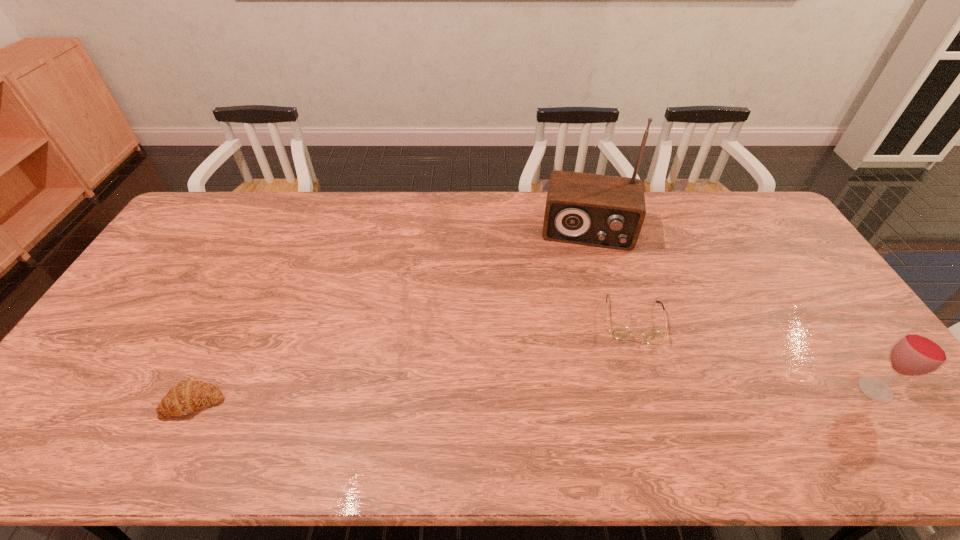
At what (x,y) coordinates should I click in order to perform the action: click on free point located on the lenses of the spectacles. Please return your answer as a coordinate pair (x, y). The height and width of the screenshot is (540, 960). Looking at the image, I should click on (638, 391).

Locate an element on the screen. The width and height of the screenshot is (960, 540). free point located on the front-facing side of the farthest object is located at coordinates (581, 331).

You are a GUI agent. You are given a task and a screenshot of the screen. Output one action in this format:
    pyautogui.click(x=<x>, y=<y>)
    Task: Click on the free location located 0.090m on the front-facing side of the farthest object
    Image resolution: width=960 pixels, height=540 pixels.
    Given the screenshot: What is the action you would take?
    pyautogui.click(x=583, y=271)

Find the location of `blank space located on the front-facing side of the farthest object`. blank space located on the front-facing side of the farthest object is located at coordinates (584, 267).

What are the coordinates of `object that is at the far edge` in the screenshot? It's located at (597, 210).

At what (x,y) coordinates should I click in order to perform the action: click on crescent roll that is at the near edge. Please return your answer as a coordinate pair (x, y). Image resolution: width=960 pixels, height=540 pixels. Looking at the image, I should click on (187, 396).

Locate an element on the screen. wineglass at the near edge is located at coordinates (917, 352).

Find the location of a particular element. This screenshot has width=960, height=540. object that is positioned at the right edge is located at coordinates (917, 352).

The height and width of the screenshot is (540, 960). Find the location of `object that is at the near right corner`. object that is at the near right corner is located at coordinates (917, 352).

Find the location of a particular element. Image resolution: width=960 pixels, height=540 pixels. free region at the far edge of the desktop is located at coordinates (239, 231).